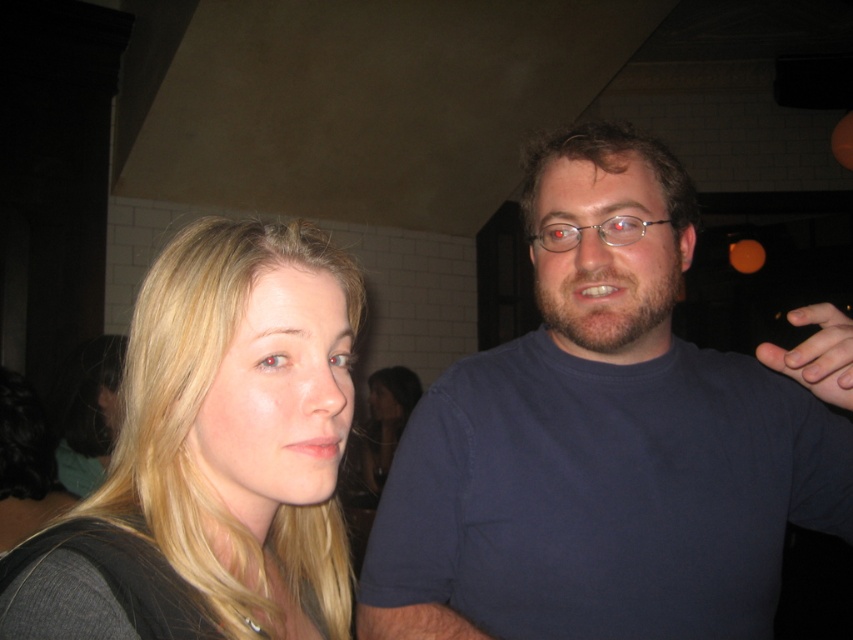
Question: Does blonde hair at left have a smaller size compared to smooth skin hand at right?

Choices:
 (A) yes
 (B) no

Answer: (A)

Question: Which object appears closest to the camera in this image?

Choices:
 (A) blue cotton shirt at right
 (B) blonde hair at left

Answer: (B)

Question: Is blue cotton shirt at right above smooth skin hand at right?

Choices:
 (A) yes
 (B) no

Answer: (B)

Question: Is blue cotton shirt at right bigger than blonde hair at left?

Choices:
 (A) no
 (B) yes

Answer: (B)

Question: Which is nearer to the smooth skin hand at right?

Choices:
 (A) blue cotton shirt at right
 (B) blonde hair at left

Answer: (A)

Question: Which point is farther to the camera?

Choices:
 (A) (316, 452)
 (B) (621, 604)

Answer: (B)